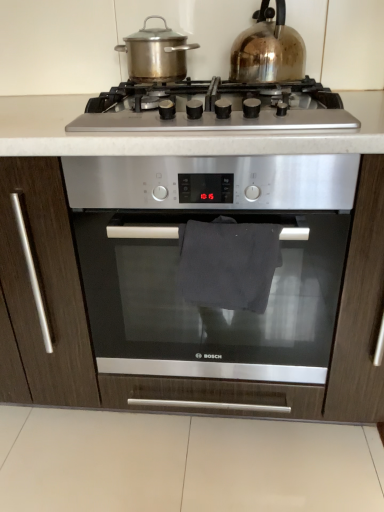
Where is `free spot to the left of shiny metallic kettle at upper right, which is counted as the 1th kitchen appliance, starting from the right`? The height and width of the screenshot is (512, 384). free spot to the left of shiny metallic kettle at upper right, which is counted as the 1th kitchen appliance, starting from the right is located at coordinates (200, 83).